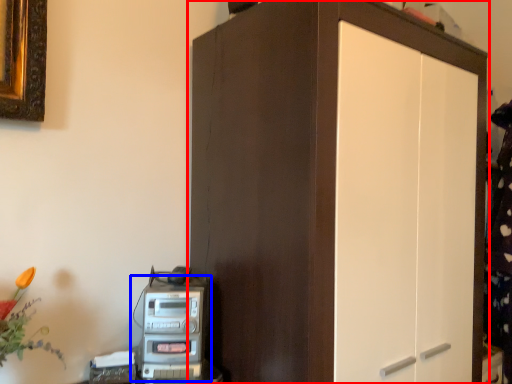
Question: Among these objects, which one is farthest to the camera, cupboard (highlighted by a red box) or home appliance (highlighted by a blue box)?

Choices:
 (A) cupboard
 (B) home appliance

Answer: (B)